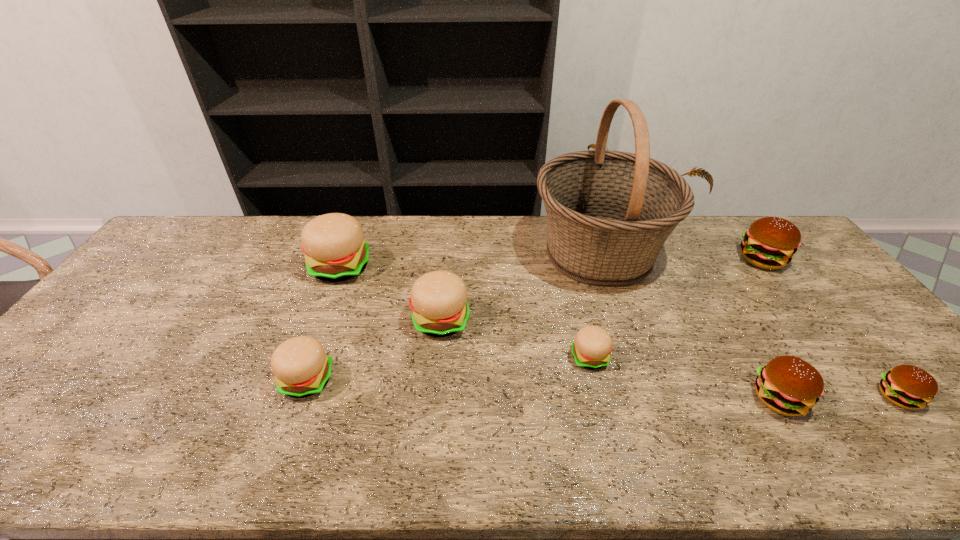
Where is `object that is at the far right corner`? object that is at the far right corner is located at coordinates (770, 242).

Image resolution: width=960 pixels, height=540 pixels. I want to click on free region at the far edge of the desktop, so point(687,242).

In the image, there is a desktop. Where is `free space at the near edge`? free space at the near edge is located at coordinates (684, 460).

Locate an element on the screen. The width and height of the screenshot is (960, 540). vacant area at the left edge of the desktop is located at coordinates (171, 268).

Identify the location of empty space that is in between the biggest beige hamburger and the basket. (469, 260).

The width and height of the screenshot is (960, 540). What are the coordinates of `free space between the farthest brown hamburger and the leftmost brown hamburger` in the screenshot? It's located at (770, 328).

In order to click on vacant point located between the tallest object and the smallest brown hamburger in this screenshot , I will do `click(748, 325)`.

Identify the location of unoccupied area between the tallest object and the smallest brown hamburger. The width and height of the screenshot is (960, 540). (748, 325).

Where is `vacant area that lies between the leftmost brown hamburger and the biggest brown hamburger`? The width and height of the screenshot is (960, 540). vacant area that lies between the leftmost brown hamburger and the biggest brown hamburger is located at coordinates (770, 328).

The image size is (960, 540). Find the location of `unoccupied area between the tallest object and the second smallest brown hamburger`. unoccupied area between the tallest object and the second smallest brown hamburger is located at coordinates (688, 326).